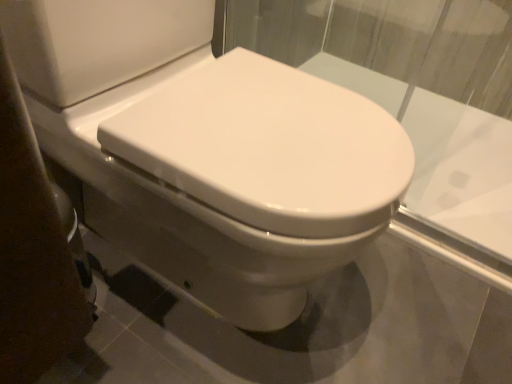
Question: Is white glossy bidet at center to the left or to the right of transparent glass at center in the image?

Choices:
 (A) right
 (B) left

Answer: (B)

Question: From the image's perspective, is white glossy bidet at center above or below transparent glass at center?

Choices:
 (A) above
 (B) below

Answer: (B)

Question: Considering their positions, is white glossy bidet at center located in front of or behind transparent glass at center?

Choices:
 (A) behind
 (B) front

Answer: (B)

Question: From the image's perspective, relative to white glossy bidet at center, is transparent glass at center above or below?

Choices:
 (A) below
 (B) above

Answer: (B)

Question: Is transparent glass at center situated inside white glossy bidet at center or outside?

Choices:
 (A) inside
 (B) outside

Answer: (A)

Question: Is transparent glass at center in front of or behind white glossy bidet at center in the image?

Choices:
 (A) behind
 (B) front

Answer: (A)

Question: Does point (232, 44) appear closer or farther from the camera than point (266, 57)?

Choices:
 (A) farther
 (B) closer

Answer: (A)